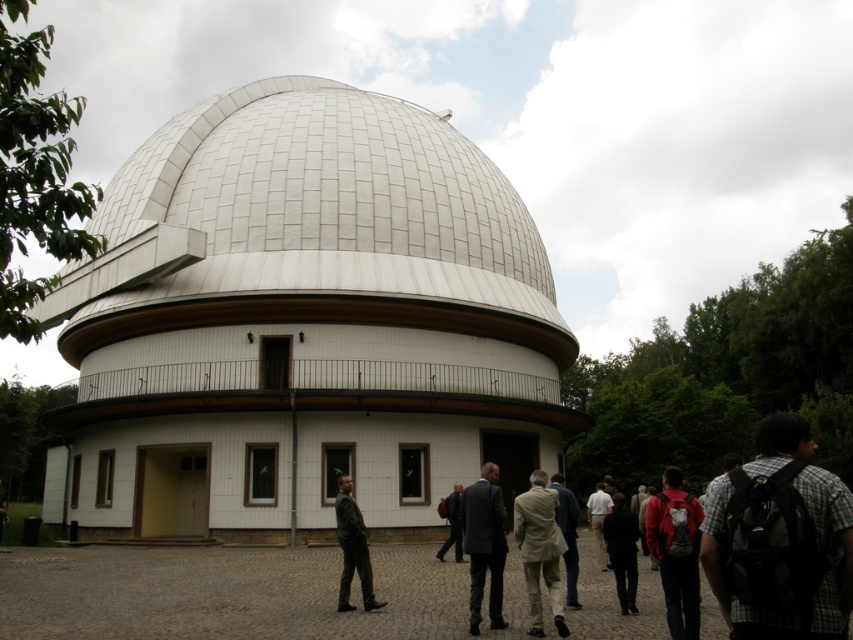
Question: Can you confirm if dark brown leather jacket at center is bigger than white cotton shirt at center?

Choices:
 (A) no
 (B) yes

Answer: (A)

Question: Which object is the farthest from the gray suit at center?

Choices:
 (A) black fabric jacket at lower center
 (B) red backpack at lower right
 (C) plaid shirt backpack at lower right

Answer: (C)

Question: Which of these objects is positioned closest to the black fabric jacket at lower center?

Choices:
 (A) light beige fabric coat at center
 (B) gray suit at center
 (C) white matte observatory at center
 (D) dark brown leather jacket at center

Answer: (A)

Question: Does white matte observatory at center appear on the left side of gray suit at center?

Choices:
 (A) yes
 (B) no

Answer: (A)

Question: Which is farther from the white matte observatory at center?

Choices:
 (A) dark gray backpack at center
 (B) white cotton shirt at center

Answer: (B)

Question: Is red backpack at lower right to the right of dark gray backpack at center from the viewer's perspective?

Choices:
 (A) yes
 (B) no

Answer: (A)